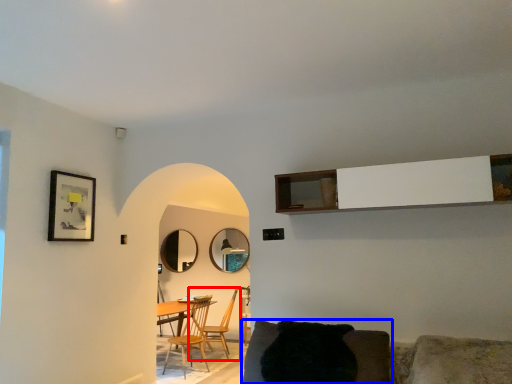
Question: Which object appears closest to the camera in this image, chair (highlighted by a red box) or chair (highlighted by a blue box)?

Choices:
 (A) chair
 (B) chair

Answer: (B)